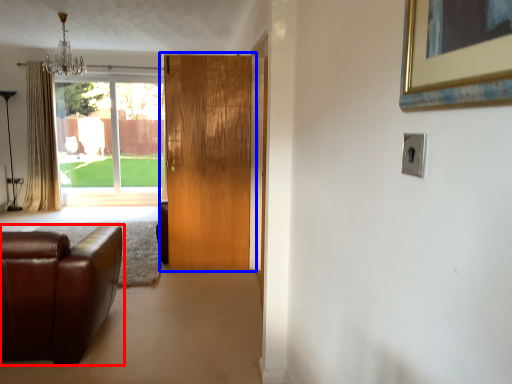
Question: Which object is closer to the camera taking this photo, studio couch (highlighted by a red box) or door (highlighted by a blue box)?

Choices:
 (A) studio couch
 (B) door

Answer: (A)